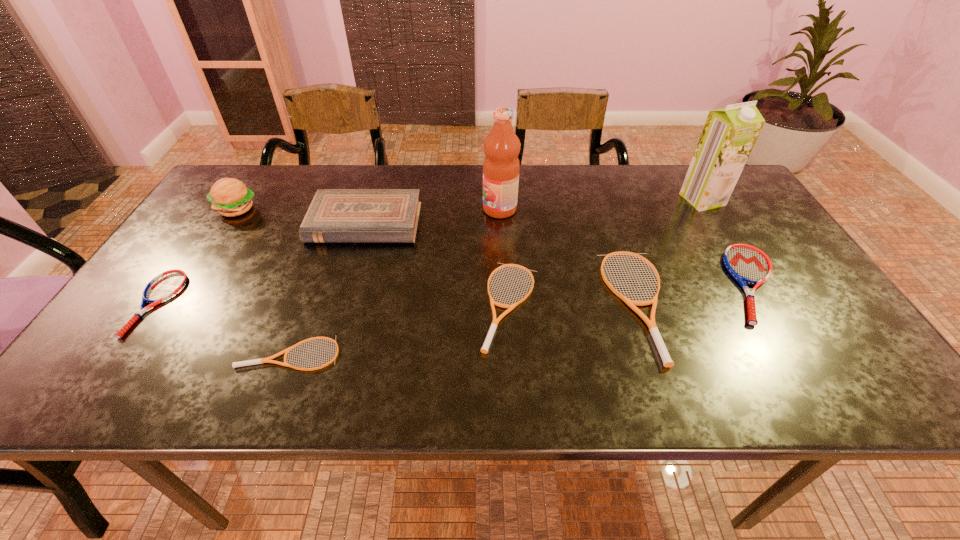
Locate an element on the screen. the second beige tennis racket from left to right is located at coordinates (487, 342).

Image resolution: width=960 pixels, height=540 pixels. What are the coordinates of `the leftmost tennis racket` in the screenshot? It's located at (165, 285).

At what (x,y) coordinates should I click in order to perform the action: click on the smaller blue tennis racket. Please return your answer as a coordinate pair (x, y). The height and width of the screenshot is (540, 960). Looking at the image, I should click on (165, 285).

Find the location of a particular element. This screenshot has width=960, height=540. the smallest beige tennis racket is located at coordinates (263, 360).

Find the location of `the second tennis racket from left to right`. the second tennis racket from left to right is located at coordinates (263, 360).

The height and width of the screenshot is (540, 960). Find the location of `vacant space located on the front of the green soya milk`. vacant space located on the front of the green soya milk is located at coordinates (769, 309).

Locate an element on the screen. The width and height of the screenshot is (960, 540). blank space located on the front label of the fruit juice is located at coordinates (417, 210).

You are a GUI agent. You are given a task and a screenshot of the screen. Output one action in this format:
    pyautogui.click(x=<x>, y=<y>)
    Task: Click on the vacant space located on the front label of the fruit juice
    
    Given the screenshot: What is the action you would take?
    pyautogui.click(x=410, y=210)

Identify the location of free space located on the front label of the fruit juice. The width and height of the screenshot is (960, 540). (369, 210).

You are a GUI agent. You are given a task and a screenshot of the screen. Output one action in this format:
    pyautogui.click(x=<x>, y=<y>)
    Task: Click on the free space located on the right of the seventh shortest object
    The height and width of the screenshot is (540, 960).
    Given the screenshot: What is the action you would take?
    pyautogui.click(x=328, y=209)